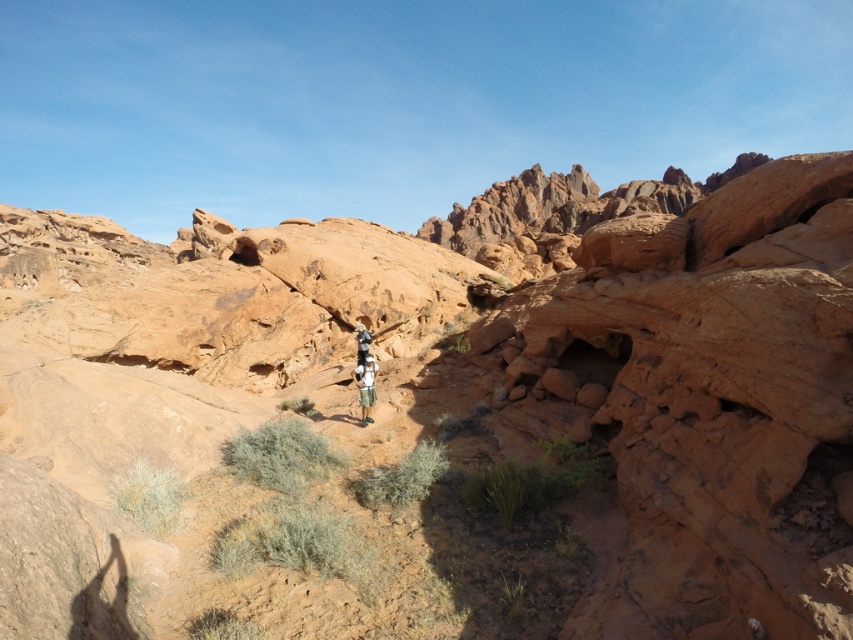
Does camouflage fabric shorts at center appear over white cotton shirt at center?

Incorrect, camouflage fabric shorts at center is not positioned above white cotton shirt at center.

Which is behind, point (367, 422) or point (368, 337)?

Point (368, 337)

In order to click on camouflage fabric shorts at center in this screenshot , I will do `click(366, 387)`.